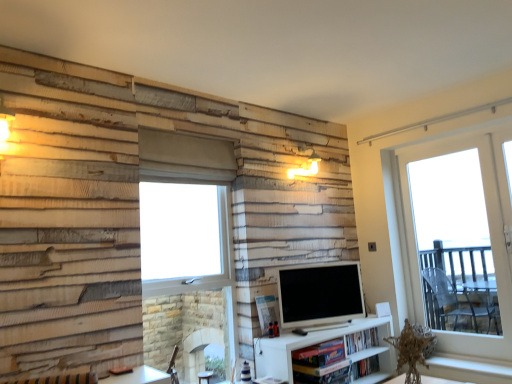
Question: From the image's perspective, is matte white tv at center above clear glass window at center, which appears as the first window when viewed from the left?

Choices:
 (A) yes
 (B) no

Answer: (B)

Question: Is matte white tv at center facing towards clear glass window at center, placed as the 2th window when sorted from right to left?

Choices:
 (A) no
 (B) yes

Answer: (A)

Question: Is clear glass window at center, placed as the 2th window when sorted from right to left, completely or partially inside matte white tv at center?

Choices:
 (A) no
 (B) yes

Answer: (A)

Question: From a real-world perspective, does matte white tv at center sit lower than clear glass window at center, which appears as the first window when viewed from the left?

Choices:
 (A) yes
 (B) no

Answer: (A)

Question: Considering the relative sizes of matte white tv at center and clear glass window at center, which appears as the first window when viewed from the left, in the image provided, is matte white tv at center shorter than clear glass window at center, which appears as the first window when viewed from the left,?

Choices:
 (A) yes
 (B) no

Answer: (A)

Question: Is matte white tv at center not within clear glass window at center, which appears as the first window when viewed from the left?

Choices:
 (A) yes
 (B) no

Answer: (A)

Question: From a real-world perspective, is clear glass window at center, which appears as the first window when viewed from the left, below matte white tv at center?

Choices:
 (A) yes
 (B) no

Answer: (B)

Question: Considering the relative sizes of clear glass window at center, which appears as the first window when viewed from the left, and matte white tv at center in the image provided, is clear glass window at center, which appears as the first window when viewed from the left, shorter than matte white tv at center?

Choices:
 (A) yes
 (B) no

Answer: (B)

Question: Is clear glass window at center, which appears as the first window when viewed from the left, aimed at matte white tv at center?

Choices:
 (A) yes
 (B) no

Answer: (B)

Question: Is there a large distance between clear glass window at center, which appears as the first window when viewed from the left, and matte white tv at center?

Choices:
 (A) yes
 (B) no

Answer: (B)

Question: Could matte white tv at center be considered to be inside clear glass window at center, placed as the 2th window when sorted from right to left?

Choices:
 (A) yes
 (B) no

Answer: (B)

Question: Can you confirm if clear glass window at center, which appears as the first window when viewed from the left, is positioned to the right of matte white tv at center?

Choices:
 (A) no
 (B) yes

Answer: (A)

Question: Is there a large distance between matte white tv at center and white wood window sill at lower right?

Choices:
 (A) yes
 (B) no

Answer: (A)